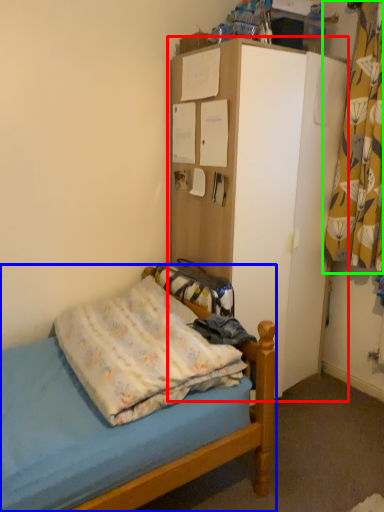
Question: Considering the real-world distances, which object is closest to dresser (highlighted by a red box)? bed (highlighted by a blue box) or curtain (highlighted by a green box).

Choices:
 (A) bed
 (B) curtain

Answer: (B)